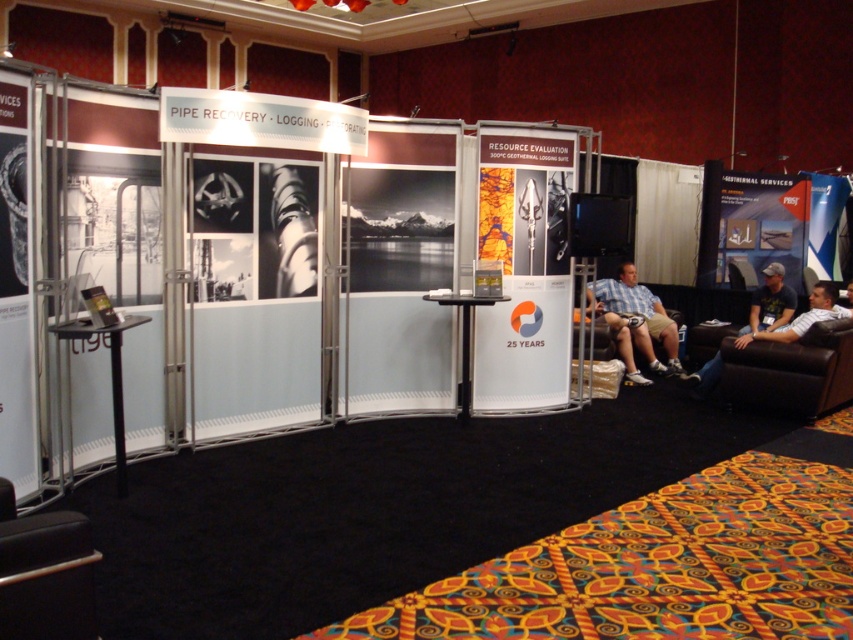
Question: Does metallic silver pipe at left have a greater width compared to black leather armchair at lower left?

Choices:
 (A) yes
 (B) no

Answer: (B)

Question: Which object is positioned closest to the plaid shirt shorts at right?

Choices:
 (A) metallic silver pipe at left
 (B) matte blue poster at right

Answer: (B)

Question: Is metallic silver pipe at left smaller than black leather armchair at lower left?

Choices:
 (A) yes
 (B) no

Answer: (B)

Question: Which of the following is the farthest from the observer?

Choices:
 (A) (569, 132)
 (B) (830, 227)
 (C) (0, 499)
 (D) (730, 224)

Answer: (B)

Question: Is black leather armchair at lower left below dark brown leather couch at lower right?

Choices:
 (A) yes
 (B) no

Answer: (A)

Question: Which object appears closest to the camera in this image?

Choices:
 (A) black leather armchair at lower left
 (B) dark brown leather couch at lower right

Answer: (A)